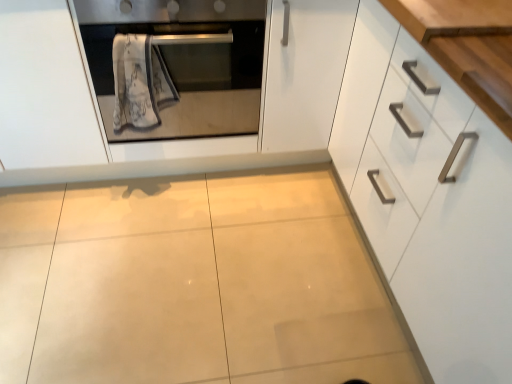
Question: Can you confirm if wooden at upper right is positioned to the right of satin silver oven at upper left?

Choices:
 (A) no
 (B) yes

Answer: (B)

Question: Is wooden at upper right thinner than satin silver oven at upper left?

Choices:
 (A) yes
 (B) no

Answer: (A)

Question: Is wooden at upper right directly adjacent to satin silver oven at upper left?

Choices:
 (A) no
 (B) yes

Answer: (A)

Question: From the image's perspective, is wooden at upper right located beneath satin silver oven at upper left?

Choices:
 (A) no
 (B) yes

Answer: (B)

Question: Is wooden at upper right facing towards satin silver oven at upper left?

Choices:
 (A) no
 (B) yes

Answer: (A)

Question: In terms of size, does satin silver oven at upper left appear bigger or smaller than white textured towel at center?

Choices:
 (A) big
 (B) small

Answer: (A)

Question: Is satin silver oven at upper left wider or thinner than white textured towel at center?

Choices:
 (A) wide
 (B) thin

Answer: (A)

Question: Based on their positions, is satin silver oven at upper left located to the left or right of white textured towel at center?

Choices:
 (A) left
 (B) right

Answer: (B)

Question: Is point (229, 109) positioned closer to the camera than point (118, 109)?

Choices:
 (A) farther
 (B) closer

Answer: (A)

Question: From the image's perspective, is satin silver oven at upper left positioned above or below white glossy cabinet at right?

Choices:
 (A) below
 (B) above

Answer: (B)

Question: Is satin silver oven at upper left in front of or behind white glossy cabinet at right in the image?

Choices:
 (A) behind
 (B) front

Answer: (A)

Question: Looking at their shapes, would you say satin silver oven at upper left is wider or thinner than white glossy cabinet at right?

Choices:
 (A) thin
 (B) wide

Answer: (B)

Question: From their relative heights in the image, would you say satin silver oven at upper left is taller or shorter than white glossy cabinet at right?

Choices:
 (A) short
 (B) tall

Answer: (A)

Question: From the image's perspective, is white textured towel at center located above or below satin silver oven at upper left?

Choices:
 (A) below
 (B) above

Answer: (A)

Question: Considering the positions of point (143, 107) and point (109, 23), is point (143, 107) closer or farther from the camera than point (109, 23)?

Choices:
 (A) closer
 (B) farther

Answer: (B)